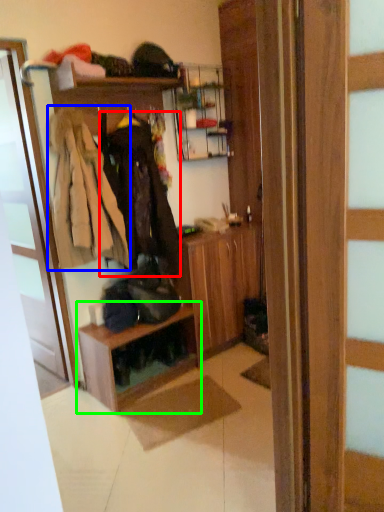
Question: Estimate the real-world distances between objects in this image. Which object is closer to clothing (highlighted by a red box), clothing (highlighted by a blue box) or shelf (highlighted by a green box)?

Choices:
 (A) clothing
 (B) shelf

Answer: (A)